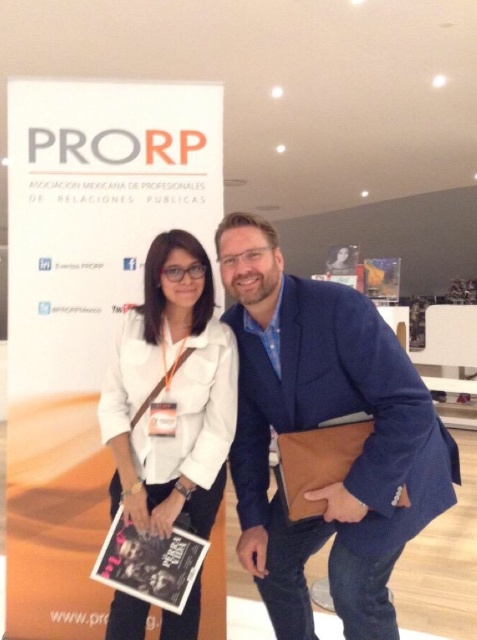
Does blue fabric jacket at center have a larger size compared to white fabric shirt at center?

Indeed, blue fabric jacket at center has a larger size compared to white fabric shirt at center.

Is blue fabric jacket at center to the left of white fabric shirt at center from the viewer's perspective?

In fact, blue fabric jacket at center is to the right of white fabric shirt at center.

Describe the element at coordinates (315, 426) in the screenshot. I see `blue fabric jacket at center` at that location.

Locate an element on the screen. blue fabric jacket at center is located at coordinates (315, 426).